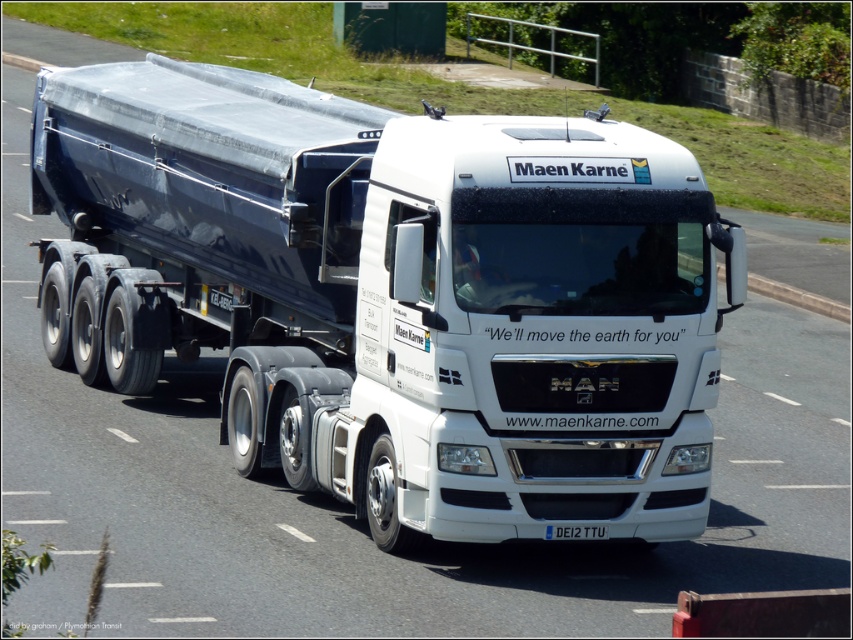
Does white glossy truck at center have a greater height compared to white plastic license plate at center?

Indeed, white glossy truck at center has a greater height compared to white plastic license plate at center.

What do you see at coordinates (395, 292) in the screenshot?
I see `white glossy truck at center` at bounding box center [395, 292].

Describe the element at coordinates (395, 292) in the screenshot. I see `white glossy truck at center` at that location.

At what (x,y) coordinates should I click in order to perform the action: click on white glossy truck at center. Please return your answer as a coordinate pair (x, y). The width and height of the screenshot is (853, 640). Looking at the image, I should click on (395, 292).